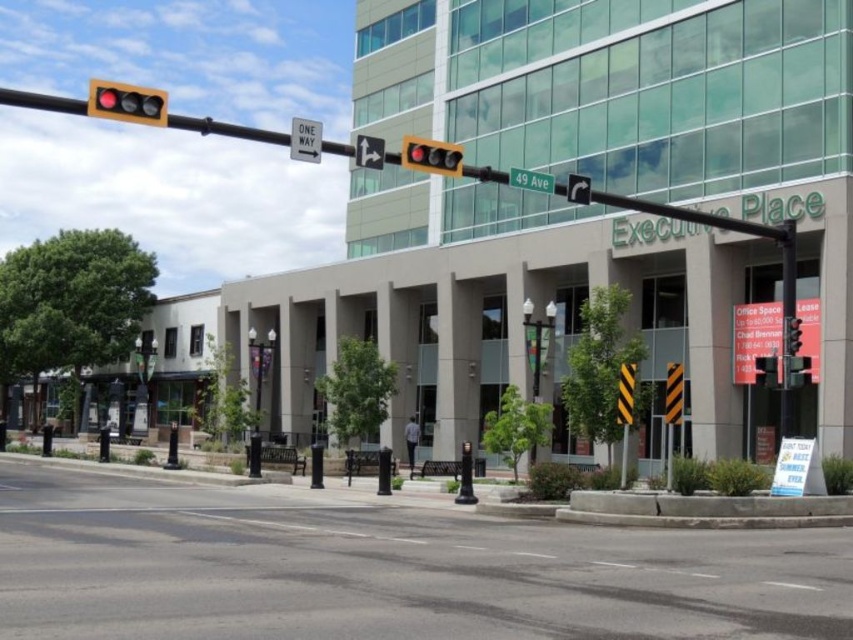
Is matte black traffic light at upper center bigger than white plastic one-way sign at upper center?

Correct, matte black traffic light at upper center is larger in size than white plastic one-way sign at upper center.

From the picture: Measure the distance between point (428, 164) and camera.

Point (428, 164) is 16.69 meters away from camera.

Is point (422, 170) more distant than point (299, 131)?

Yes.

The width and height of the screenshot is (853, 640). I want to click on matte black traffic light at upper center, so click(x=431, y=156).

Can you confirm if matte black traffic light at upper left is bigger than metallic traffic light at right?

Correct, matte black traffic light at upper left is larger in size than metallic traffic light at right.

Between point (90, 81) and point (799, 342), which one is positioned behind?

The point (90, 81) is more distant.

Measure the distance between matte black traffic light at upper left and camera.

matte black traffic light at upper left is 14.21 meters from camera.

Locate an element on the screen. This screenshot has height=640, width=853. matte black traffic light at upper left is located at coordinates (126, 102).

Does black asphalt road at center have a larger size compared to white plastic one-way sign at upper center?

Correct, black asphalt road at center is larger in size than white plastic one-way sign at upper center.

Can you confirm if black asphalt road at center is positioned below white plastic one-way sign at upper center?

Correct, black asphalt road at center is located below white plastic one-way sign at upper center.

Which is in front, point (434, 605) or point (296, 160)?

Point (434, 605) is more forward.

Locate an element on the screen. black asphalt road at center is located at coordinates (386, 570).